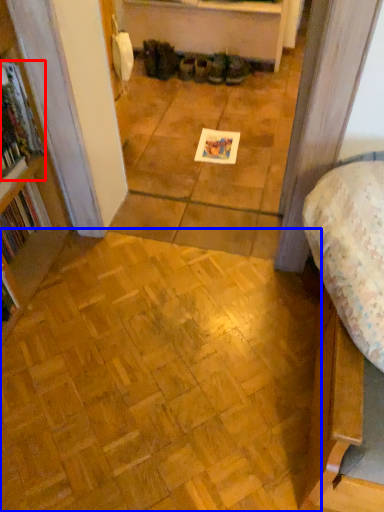
Question: Which object appears farthest to the camera in this image, book (highlighted by a red box) or plywood (highlighted by a blue box)?

Choices:
 (A) book
 (B) plywood

Answer: (A)